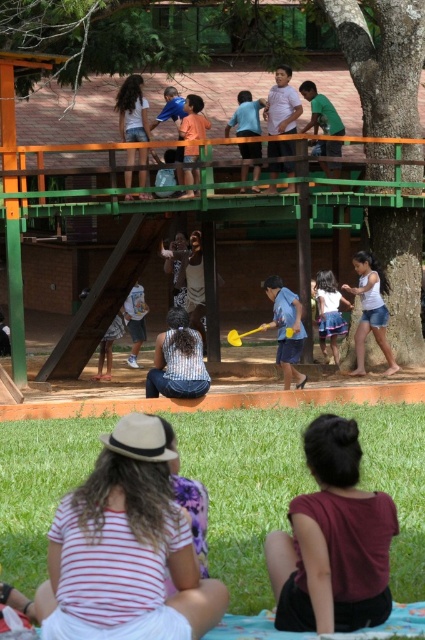
Question: Does dark maroon shirt at lower right appear over orange matte shirt at center?

Choices:
 (A) no
 (B) yes

Answer: (A)

Question: Is striped shirt at center positioned at the back of blue denim skirt at center?

Choices:
 (A) yes
 (B) no

Answer: (B)

Question: Among these objects, which one is nearest to the camera?

Choices:
 (A) green grass at lower center
 (B) green rough bark tree at center
 (C) blue denim skirt at center
 (D) green rough bark tree at upper center

Answer: (A)

Question: In this image, where is green grass at lower center located relative to green rough bark tree at upper center?

Choices:
 (A) below
 (B) above

Answer: (A)

Question: Among these points, which one is farthest from the camera?

Choices:
 (A) (289, 301)
 (B) (246, 168)
 (C) (170, 396)
 (D) (255, 508)

Answer: (B)

Question: Which object is closer to the camera taking this photo?

Choices:
 (A) striped shirt at center
 (B) yellow rubber mallet at center
 (C) orange matte shirt at center
 (D) blue denim skirt at center

Answer: (A)